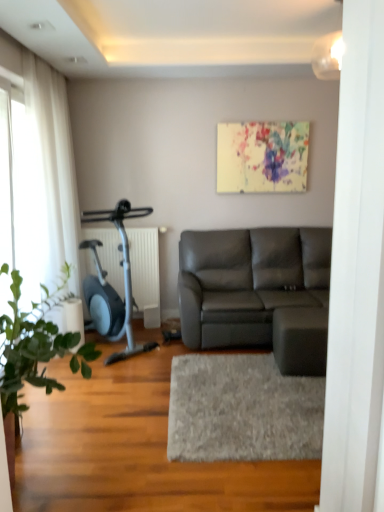
Question: Which is correct: transparent glass door at left is inside white sheer curtain at left, or outside of it?

Choices:
 (A) inside
 (B) outside

Answer: (B)

Question: From a real-world perspective, relative to white sheer curtain at left, is transparent glass door at left vertically above or below?

Choices:
 (A) above
 (B) below

Answer: (A)

Question: Which of these objects is positioned farthest from the metallic blue stationary bicycle at left?

Choices:
 (A) green leafy plant at left
 (B) white sheer curtain at left
 (C) white shaggy rug at center
 (D) transparent glass door at left
 (E) matte gray leather couch at center

Answer: (A)

Question: Which is farther from the green leafy plant at left?

Choices:
 (A) metallic blue stationary bicycle at left
 (B) transparent glass door at left
 (C) white shaggy rug at center
 (D) white sheer curtain at left
 (E) matte gray leather couch at center

Answer: (E)